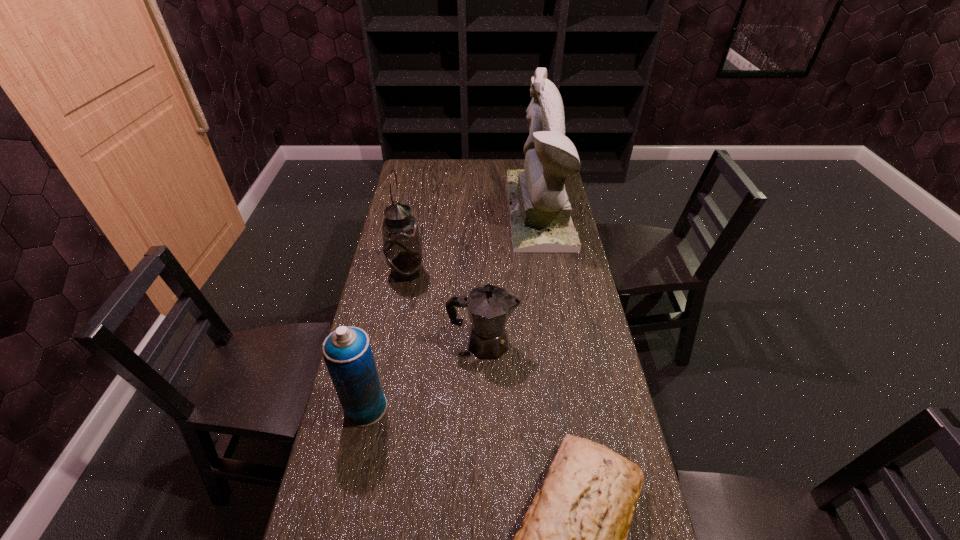
I want to click on free space at the left edge of the desktop, so click(397, 363).

Find the location of a particular element. This screenshot has height=540, width=960. free spot at the right edge of the desktop is located at coordinates (558, 298).

Find the location of a particular element. free area in between the aerosol can and the fourth tallest object is located at coordinates (424, 375).

Identify the location of free space between the third farthest object and the oil lamp. The image size is (960, 540). (444, 308).

Identify the location of unoccupied position between the sculpture and the fourth shortest object. The image size is (960, 540). (472, 241).

Locate an element on the screen. This screenshot has width=960, height=540. vacant area that lies between the sculpture and the coffeepot is located at coordinates (512, 277).

Point out which object is positioned as the fourth nearest to the third shortest object. Please provide its 2D coordinates. Your answer should be formatted as a tuple, i.e. [(x, y)], where the tuple contains the x and y coordinates of a point satisfying the conditions above.

[(540, 212)]

Where is `object that ranks as the second closest to the bread`? The image size is (960, 540). object that ranks as the second closest to the bread is located at coordinates (347, 353).